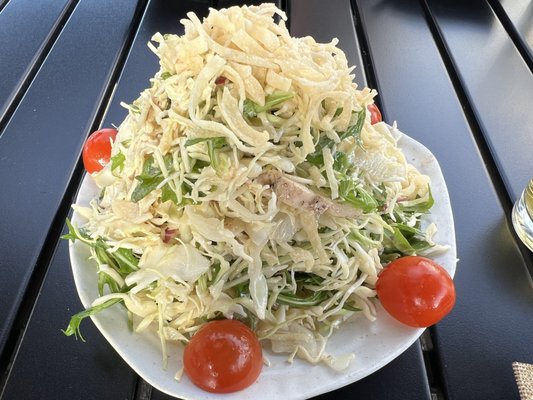
Where is `plate`? This screenshot has width=533, height=400. plate is located at coordinates (370, 353).